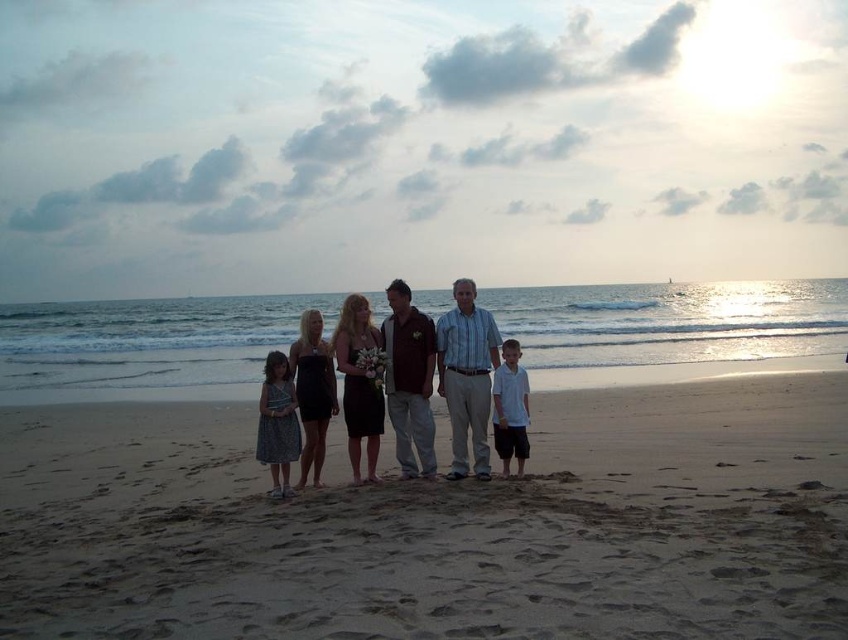
Question: Can you confirm if matte black dress at center is smaller than white cotton shirt at center?

Choices:
 (A) no
 (B) yes

Answer: (A)

Question: In this image, where is light brown sand at center located relative to matte black dress at center?

Choices:
 (A) right
 (B) left

Answer: (A)

Question: Which of the following is the farthest from the observer?

Choices:
 (A) light brown sand at center
 (B) matte black dress at center

Answer: (B)

Question: Which object is positioned closest to the white cotton shirt at center?

Choices:
 (A) matte black dress at center
 (B) light brown sand at center

Answer: (A)

Question: Is light brown sand at center further to camera compared to matte black dress at center?

Choices:
 (A) no
 (B) yes

Answer: (A)

Question: Among these points, which one is nearest to the camera?

Choices:
 (A) (665, 544)
 (B) (406, 291)
 (C) (501, 401)

Answer: (A)